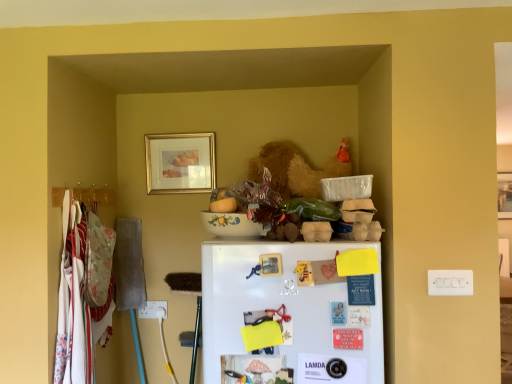
Question: Considering the relative sizes of wooden picture frame at upper right, the 1th picture frame in the back-to-front sequence, and gold-framed picture at upper center, arranged as the 2th picture frame when viewed from the back, in the image provided, is wooden picture frame at upper right, the 1th picture frame in the back-to-front sequence, smaller than gold-framed picture at upper center, arranged as the 2th picture frame when viewed from the back,?

Choices:
 (A) no
 (B) yes

Answer: (A)

Question: Is wooden picture frame at upper right, which is counted as the 2th picture frame, starting from the front, facing towards gold-framed picture at upper center, which appears as the 1th picture frame when viewed from the front?

Choices:
 (A) yes
 (B) no

Answer: (B)

Question: Can you confirm if wooden picture frame at upper right, which is counted as the 2th picture frame, starting from the front, is bigger than gold-framed picture at upper center, arranged as the 2th picture frame when viewed from the back?

Choices:
 (A) yes
 (B) no

Answer: (A)

Question: Can you confirm if wooden picture frame at upper right, positioned as the second picture frame in left-to-right order, is wider than gold-framed picture at upper center, arranged as the 2th picture frame when viewed from the back?

Choices:
 (A) yes
 (B) no

Answer: (A)

Question: From the image's perspective, is wooden picture frame at upper right, which is counted as the 2th picture frame, starting from the front, over gold-framed picture at upper center, which is the 1th picture frame from left to right?

Choices:
 (A) no
 (B) yes

Answer: (A)

Question: Is wooden picture frame at upper right, the 1th picture frame from the right, positioned far away from gold-framed picture at upper center, which is the 1th picture frame from left to right?

Choices:
 (A) no
 (B) yes

Answer: (B)

Question: Does gold-framed picture at upper center, which is the 1th picture frame from left to right, come behind wooden picture frame at upper right, the 1th picture frame in the back-to-front sequence?

Choices:
 (A) yes
 (B) no

Answer: (B)

Question: Considering the relative sizes of gold-framed picture at upper center, which is the 1th picture frame from left to right, and wooden picture frame at upper right, the 1th picture frame in the back-to-front sequence, in the image provided, is gold-framed picture at upper center, which is the 1th picture frame from left to right, wider than wooden picture frame at upper right, the 1th picture frame in the back-to-front sequence,?

Choices:
 (A) no
 (B) yes

Answer: (A)

Question: Can you confirm if gold-framed picture at upper center, which is the 1th picture frame from left to right, is taller than wooden picture frame at upper right, which is counted as the 2th picture frame, starting from the front?

Choices:
 (A) no
 (B) yes

Answer: (A)

Question: Is gold-framed picture at upper center, which is counted as the 2th picture frame, starting from the right, oriented towards wooden picture frame at upper right, the 1th picture frame from the right?

Choices:
 (A) no
 (B) yes

Answer: (A)

Question: Is wooden picture frame at upper right, the 1th picture frame in the back-to-front sequence, located within gold-framed picture at upper center, which appears as the 1th picture frame when viewed from the front?

Choices:
 (A) no
 (B) yes

Answer: (A)

Question: Would you say gold-framed picture at upper center, which appears as the 1th picture frame when viewed from the front, is outside wooden picture frame at upper right, the 1th picture frame from the right?

Choices:
 (A) yes
 (B) no

Answer: (A)

Question: Is wooden picture frame at upper right, positioned as the second picture frame in left-to-right order, behind white matte refrigerator at center?

Choices:
 (A) no
 (B) yes

Answer: (B)